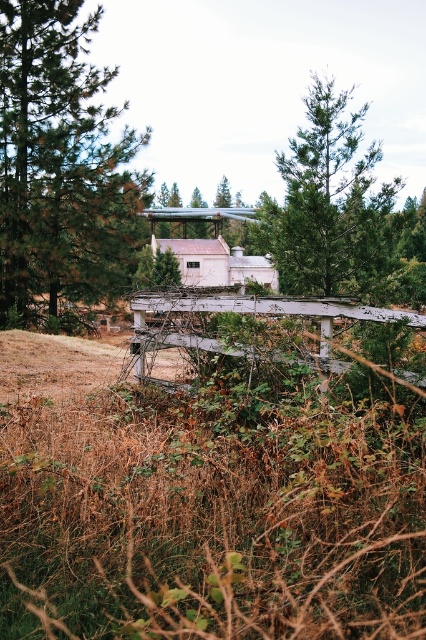
Question: Is brown dry grass at lower left bigger than green textured pine tree at upper center?

Choices:
 (A) yes
 (B) no

Answer: (B)

Question: Does green textured pine tree at left have a greater width compared to green textured pine tree at upper center?

Choices:
 (A) yes
 (B) no

Answer: (A)

Question: Is brown dry grass at lower left below white weathered wood fence at center?

Choices:
 (A) no
 (B) yes

Answer: (B)

Question: Considering the real-world distances, which object is farthest from the white weathered wood fence at center?

Choices:
 (A) green textured pine tree at upper center
 (B) green textured pine tree at left

Answer: (B)

Question: Among these objects, which one is nearest to the camera?

Choices:
 (A) white weathered wood fence at center
 (B) brown dry grass at lower left
 (C) green textured pine tree at left

Answer: (B)

Question: Which point is closer to the camera taking this photo?

Choices:
 (A) (5, 346)
 (B) (29, 141)

Answer: (A)